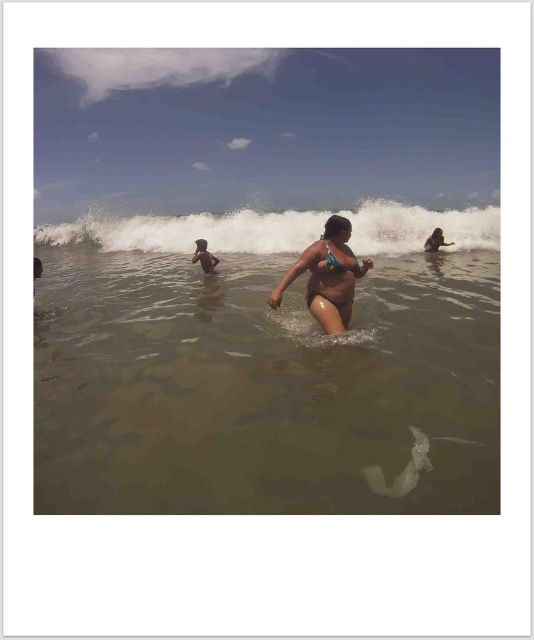
You are a photographer trying to capture the matte yellow bikini at center in your shot. Based on the scene description, where should you position your camera to ensure the bikini is centered in your frame?

To center the matte yellow bikini at center in your frame, position your camera so that the crosshairs align with the coordinates provided at point (332, 280).

Looking at this image, you are a photographer trying to capture the surfer in the scene. Since the brown matte water at center is larger than the smooth skin surfer at center, where should you position your camera to ensure the surfer is fully visible without the water blocking them?

Position the camera so the smooth skin surfer at center is placed to the side of the brown matte water at center, as the water is larger and might obscure the surfer if they are centered together.

You are a photographer at the beach and want to capture a photo of the blue bikini at center and the smooth skin girl at upper right. If you want both subjects to be in focus, which one should you focus on first?

The blue bikini at center has a larger size compared to smooth skin girl at upper right, so you should focus on the blue bikini at center first to ensure both are in focus.